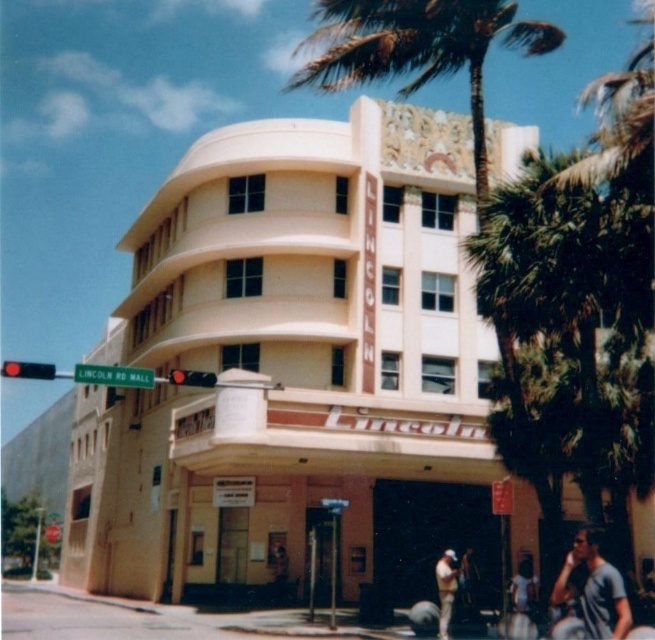
You are standing on the sidewalk in front of the Lincoln Rd Mall. You want to walk up to the beige concrete building at center. How many steps would you need to take to reach it if each step you take covers 2.5 feet?

The beige concrete building at center is 129.53 feet away. Dividing 129.53 by 2.5 gives approximately 51.81 steps. Since you can only take whole steps, you would need to take 52 steps to reach the beige concrete building at center.